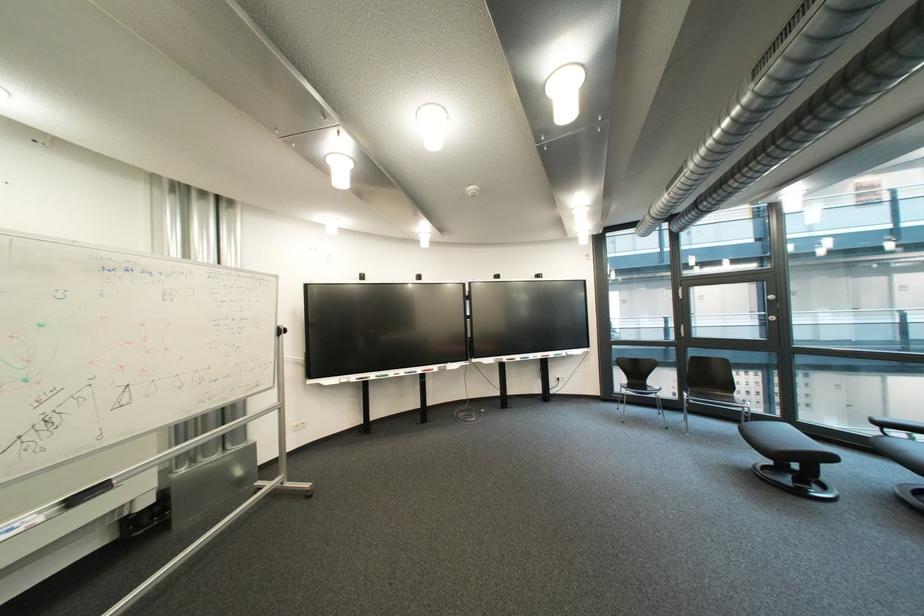
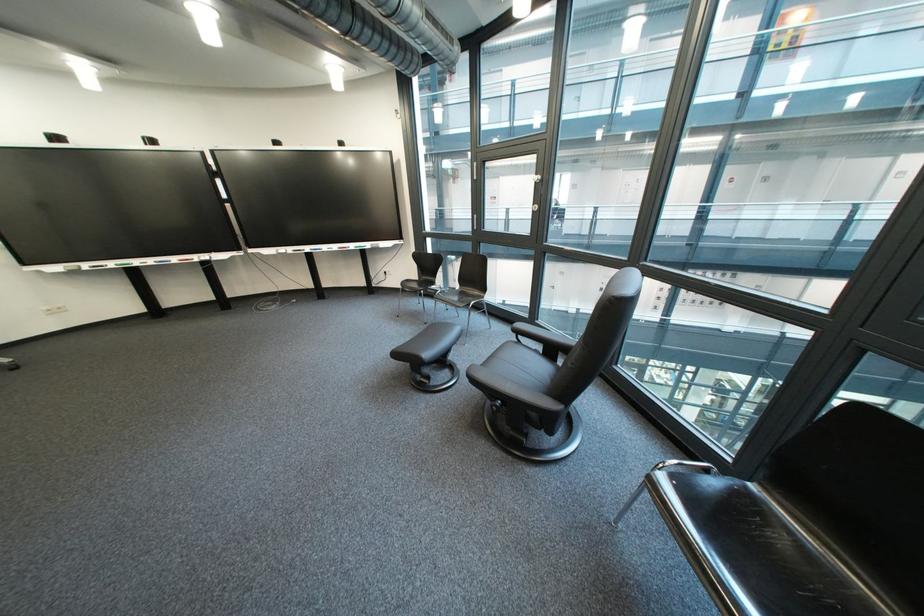
Question: In a continuous first-person perspective shot, in which direction is the camera moving?

Choices:
 (A) Left
 (B) Right
 (C) Forward
 (D) Backward

Answer: (B)